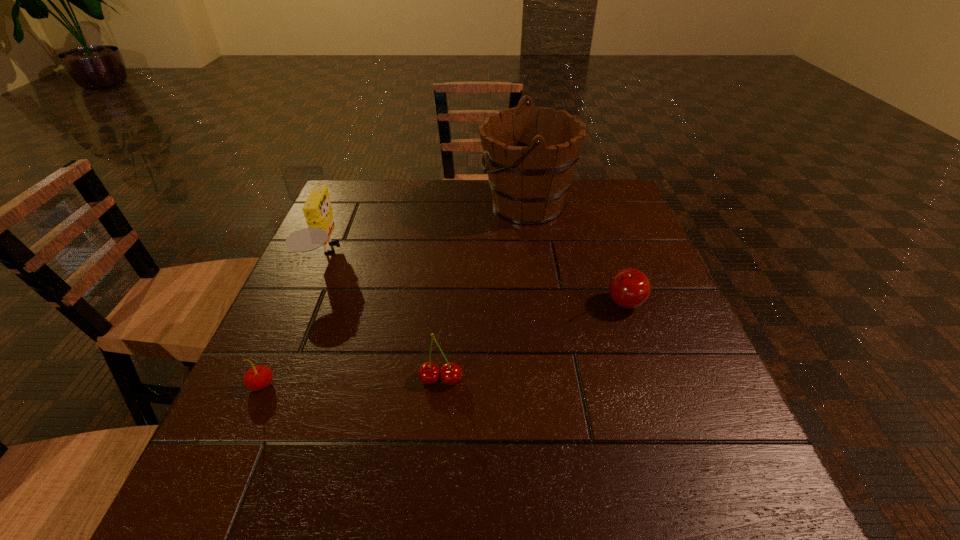
Identify the location of vacant point at the far edge. (556, 221).

This screenshot has height=540, width=960. I want to click on vacant space at the near edge of the desktop, so click(x=330, y=467).

This screenshot has height=540, width=960. Find the location of `free space at the left edge`. free space at the left edge is located at coordinates (304, 410).

The image size is (960, 540). What are the coordinates of `free point at the right edge` in the screenshot? It's located at (614, 251).

I want to click on vacant space at the far left corner of the desktop, so click(x=384, y=181).

Find the location of a particular element. This screenshot has height=540, width=960. vacant region at the near left corner of the desktop is located at coordinates tap(218, 483).

This screenshot has width=960, height=540. In the image, there is a desktop. Identify the location of vacant space at the far right corner. (578, 200).

Locate an element on the screen. This screenshot has height=540, width=960. free spot between the sponge and the wine bucket is located at coordinates (425, 231).

Locate an element on the screen. Image resolution: width=960 pixels, height=540 pixels. free spot between the fourth shortest object and the wine bucket is located at coordinates (425, 231).

Locate an element on the screen. blank region between the third object from left to right and the wine bucket is located at coordinates (484, 292).